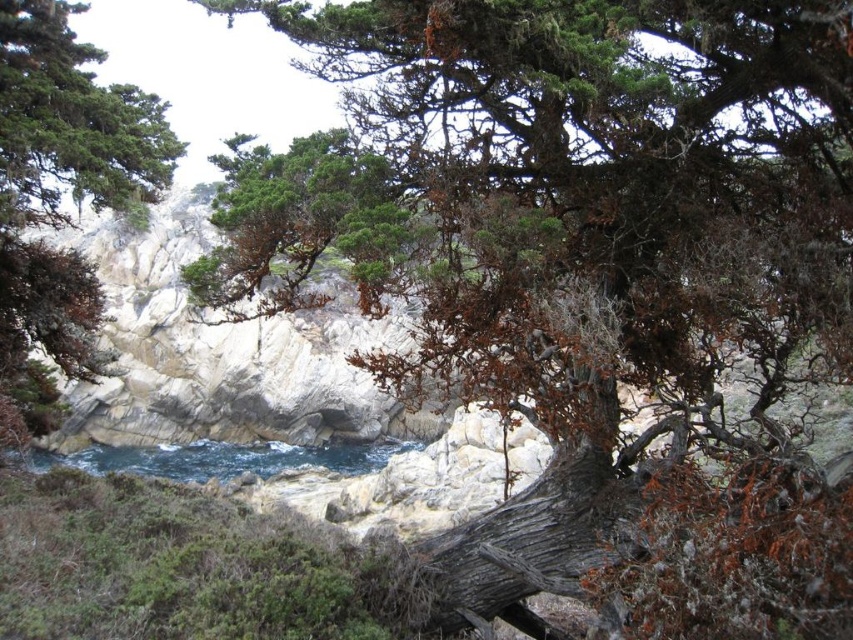
Is green matte tree at upper left wider than blue water at center?

In fact, green matte tree at upper left might be narrower than blue water at center.

Is point (13, 172) in front of point (258, 461)?

That is True.

Find the location of a particular element. The width and height of the screenshot is (853, 640). green matte tree at upper left is located at coordinates (70, 122).